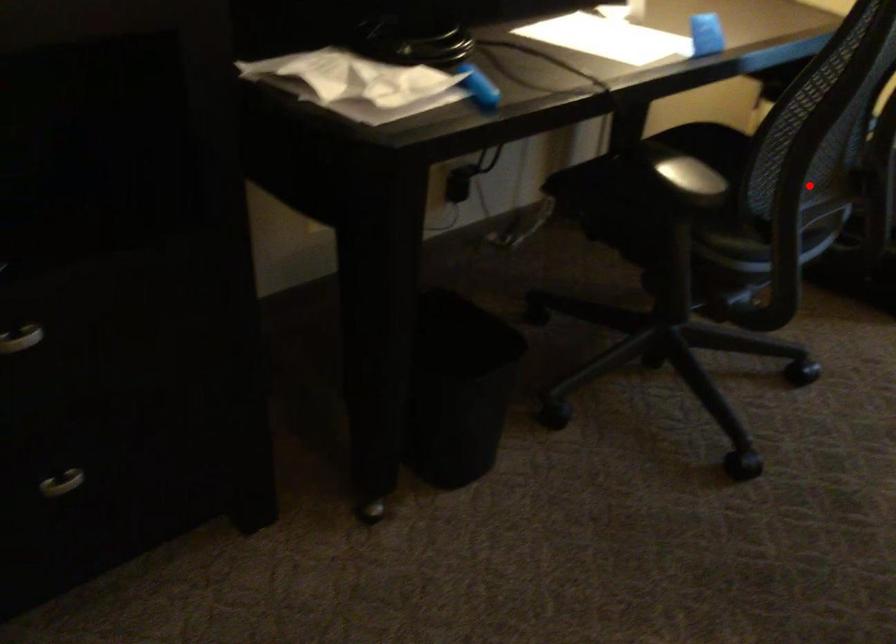
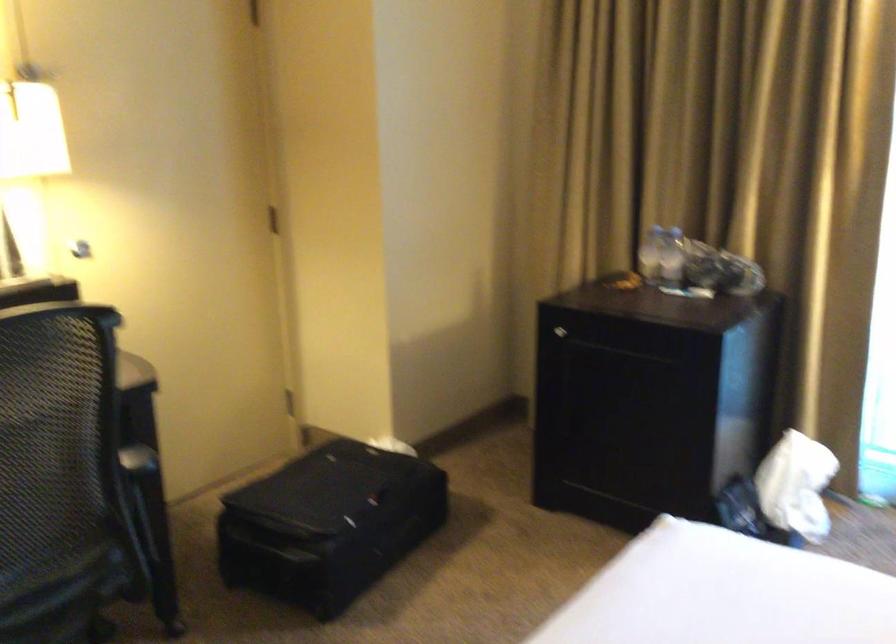
Find the pixel in the second image that matches the highlighted location in the first image.

(136, 527)